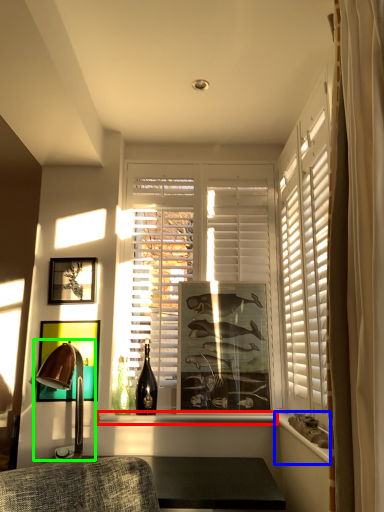
Question: Estimate the real-world distances between objects in this image. Which object is closer to window sill (highlighted by a red box), ledge (highlighted by a blue box) or table lamp (highlighted by a green box)?

Choices:
 (A) ledge
 (B) table lamp

Answer: (B)